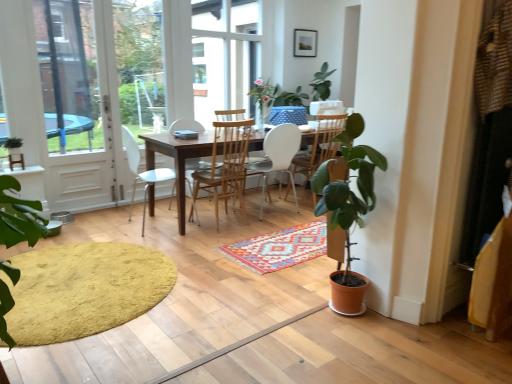
Image resolution: width=512 pixels, height=384 pixels. What are the coordinates of `vacant area on the back side of multicolored woven rug at center, the 1th doormat viewed from the right` in the screenshot? It's located at (278, 212).